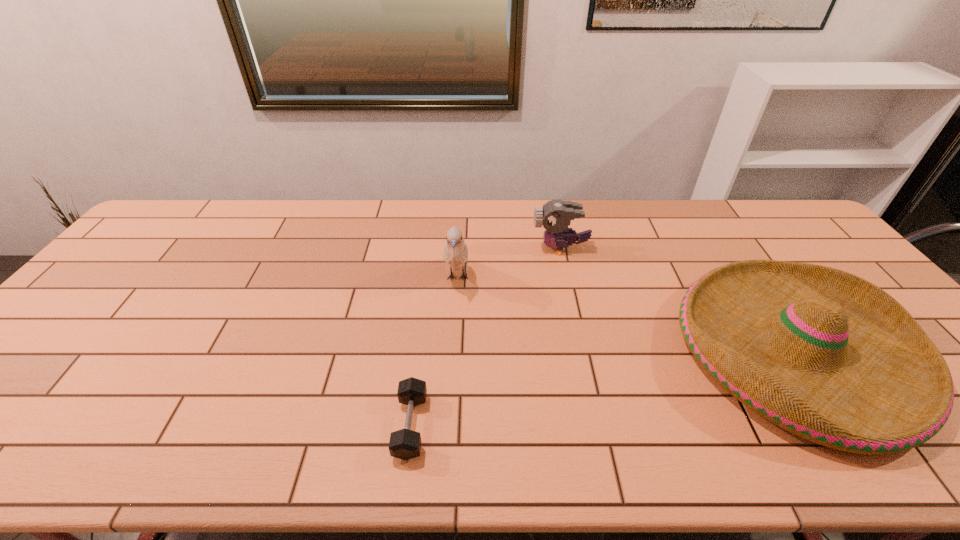
Locate an element on the screen. The height and width of the screenshot is (540, 960). the taller bird is located at coordinates pos(455,252).

Image resolution: width=960 pixels, height=540 pixels. Find the location of `the third object from right to left`. the third object from right to left is located at coordinates (455, 252).

Identify the location of the farther bird. This screenshot has width=960, height=540. (555, 216).

At what (x,y) coordinates should I click in order to perform the action: click on the farthest object. Please return your answer as a coordinate pair (x, y). Looking at the image, I should click on (555, 216).

This screenshot has width=960, height=540. I want to click on dumbbell, so click(x=405, y=444).

Where is `the leftmost object`? The image size is (960, 540). the leftmost object is located at coordinates (405, 444).

Image resolution: width=960 pixels, height=540 pixels. I want to click on free space located at the beak of the nearer bird, so click(454, 339).

Identify the location of free region located 0.120m at the beak of the farther bird. The height and width of the screenshot is (540, 960). (494, 249).

The width and height of the screenshot is (960, 540). In order to click on vacant space located 0.270m at the beak of the farther bird in this screenshot , I will do (x=447, y=249).

You are a GUI agent. You are given a task and a screenshot of the screen. Output one action in this format:
    pyautogui.click(x=<x>, y=<y>)
    Task: Click on the vacant space located 0.050m at the beak of the farther bird
    
    Given the screenshot: What is the action you would take?
    pyautogui.click(x=516, y=249)